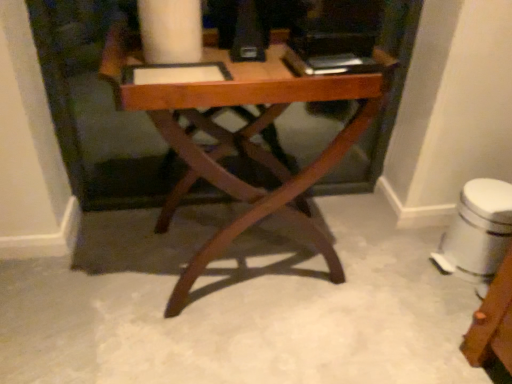
Find the location of a particular element. This screenshot has height=384, width=512. vacant area that lies to the right of wooden table at center is located at coordinates (380, 272).